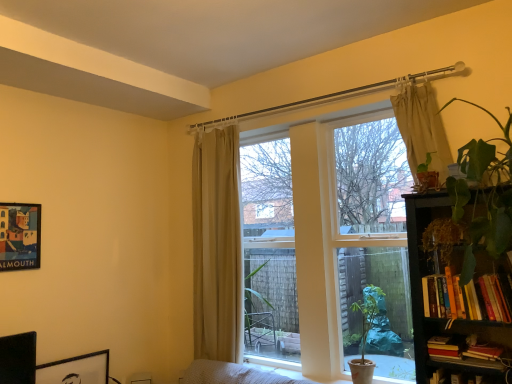
Question: Should I look upward or downward to see black matte bookcase at right?

Choices:
 (A) down
 (B) up

Answer: (A)

Question: From a real-world perspective, does hardcover book at lower right, which is counted as the second book, starting from the bottom, stand above green matte houseplant at lower right?

Choices:
 (A) no
 (B) yes

Answer: (B)

Question: Considering the relative sizes of hardcover book at lower right, acting as the 3th book starting from the top, and green matte houseplant at lower right in the image provided, is hardcover book at lower right, acting as the 3th book starting from the top, taller than green matte houseplant at lower right?

Choices:
 (A) yes
 (B) no

Answer: (B)

Question: Does hardcover book at lower right, which is counted as the second book, starting from the bottom, appear on the left side of green matte houseplant at lower right?

Choices:
 (A) no
 (B) yes

Answer: (A)

Question: Is hardcover book at lower right, which is counted as the second book, starting from the bottom, next to green matte houseplant at lower right and touching it?

Choices:
 (A) no
 (B) yes

Answer: (A)

Question: Considering the relative sizes of hardcover book at lower right, acting as the 3th book starting from the top, and green matte houseplant at lower right in the image provided, is hardcover book at lower right, acting as the 3th book starting from the top, shorter than green matte houseplant at lower right?

Choices:
 (A) yes
 (B) no

Answer: (A)

Question: Can you confirm if hardcover book at lower right, acting as the 3th book starting from the top, is wider than green matte houseplant at lower right?

Choices:
 (A) no
 (B) yes

Answer: (B)

Question: Could beige fabric curtain at upper right, the 2th curtain when ordered from left to right, be considered to be inside hardcover book at lower right, acting as the 3th book starting from the top?

Choices:
 (A) no
 (B) yes

Answer: (A)

Question: Considering the relative positions of hardcover book at lower right, which is counted as the second book, starting from the bottom, and beige fabric curtain at upper right, the 2th curtain viewed from the back, in the image provided, is hardcover book at lower right, which is counted as the second book, starting from the bottom, to the left of beige fabric curtain at upper right, the 2th curtain viewed from the back, from the viewer's perspective?

Choices:
 (A) no
 (B) yes

Answer: (A)

Question: Is hardcover book at lower right, which is counted as the second book, starting from the bottom, facing towards beige fabric curtain at upper right, marked as the first curtain in a right-to-left arrangement?

Choices:
 (A) no
 (B) yes

Answer: (A)

Question: Considering the relative positions of hardcover book at lower right, acting as the 3th book starting from the top, and beige fabric curtain at upper right, the 2th curtain when ordered from left to right, in the image provided, is hardcover book at lower right, acting as the 3th book starting from the top, in front of beige fabric curtain at upper right, the 2th curtain when ordered from left to right,?

Choices:
 (A) no
 (B) yes

Answer: (B)

Question: From a real-world perspective, is hardcover book at lower right, acting as the 3th book starting from the top, beneath beige fabric curtain at upper right, marked as the first curtain in a right-to-left arrangement?

Choices:
 (A) yes
 (B) no

Answer: (A)

Question: Considering the relative sizes of hardcover book at lower right, acting as the 3th book starting from the top, and beige fabric curtain at upper right, the 2th curtain viewed from the back, in the image provided, is hardcover book at lower right, acting as the 3th book starting from the top, bigger than beige fabric curtain at upper right, the 2th curtain viewed from the back,?

Choices:
 (A) no
 (B) yes

Answer: (A)

Question: Considering the relative sizes of black matte picture frame at lower left, the second picture frame positioned from the top, and hardcover books at lower right, which is the 2th book in top-to-bottom order, in the image provided, is black matte picture frame at lower left, the second picture frame positioned from the top, taller than hardcover books at lower right, which is the 2th book in top-to-bottom order,?

Choices:
 (A) yes
 (B) no

Answer: (A)